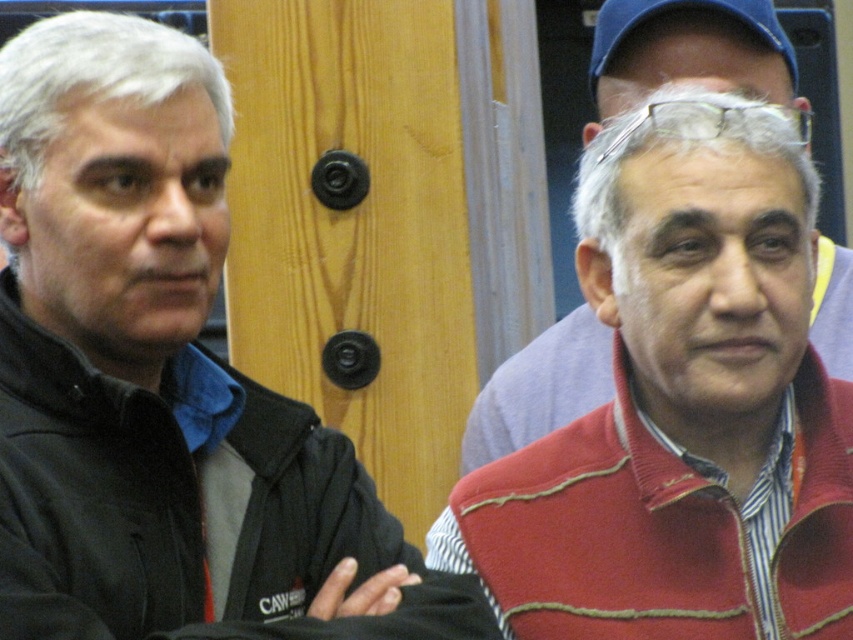
Measure the distance between black matte jacket at left and gray matte hair at upper left.

They are 23.64 inches apart.

Between black matte jacket at left and gray matte hair at upper left, which one has more height?

black matte jacket at left

Does point (158, 365) come farther from viewer compared to point (45, 68)?

Yes, it is.

Image resolution: width=853 pixels, height=640 pixels. In order to click on black matte jacket at left in this screenshot , I will do `click(160, 380)`.

Is red matte sweater at right closer to the viewer compared to gray matte hair at center?

That is False.

Is red matte sweater at right positioned behind gray matte hair at center?

Yes, red matte sweater at right is behind gray matte hair at center.

Find the location of a particular element. red matte sweater at right is located at coordinates (540, 388).

Is the position of gray matte hair at upper left less distant than that of blue fabric cap at upper center?

That is True.

Is gray matte hair at upper left thinner than blue fabric cap at upper center?

Correct, gray matte hair at upper left's width is less than blue fabric cap at upper center's.

Is point (7, 163) positioned behind point (614, 35)?

No.

Where is `gray matte hair at upper left`? This screenshot has height=640, width=853. gray matte hair at upper left is located at coordinates (93, 76).